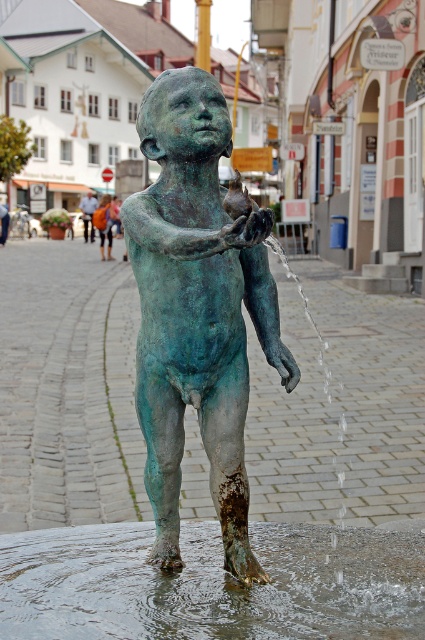
You are a photographer trying to capture the statue and its surroundings. You notice the clear liquid water at lower center and the orange fabric bag at center. Which object should you adjust your camera focus to first if you want to ensure both are in the frame?

The orange fabric bag at center should be focused on first because the clear liquid water at lower center is to the right of it, so adjusting focus on the orange fabric bag at center ensures the water is within the frame.

You are a photographer trying to capture the reflection of the orange fabric backpack at center in the clear liquid water at lower center. Is the backpack visible in the water?

The clear liquid water at lower center is positioned under orange fabric backpack at center, so the backpack is blocking the water below it. Therefore, the reflection of the orange fabric backpack at center would not be visible in the clear liquid water at lower center.